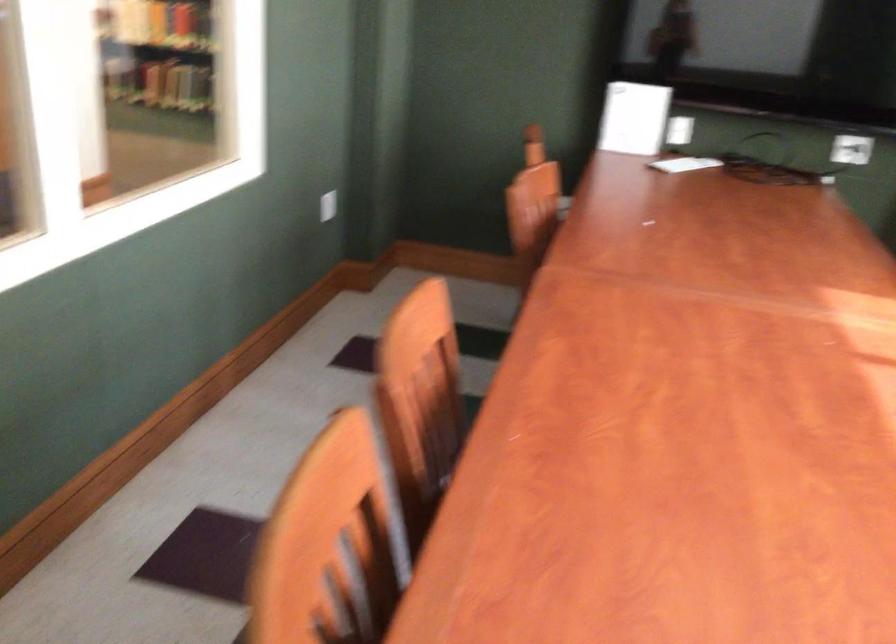
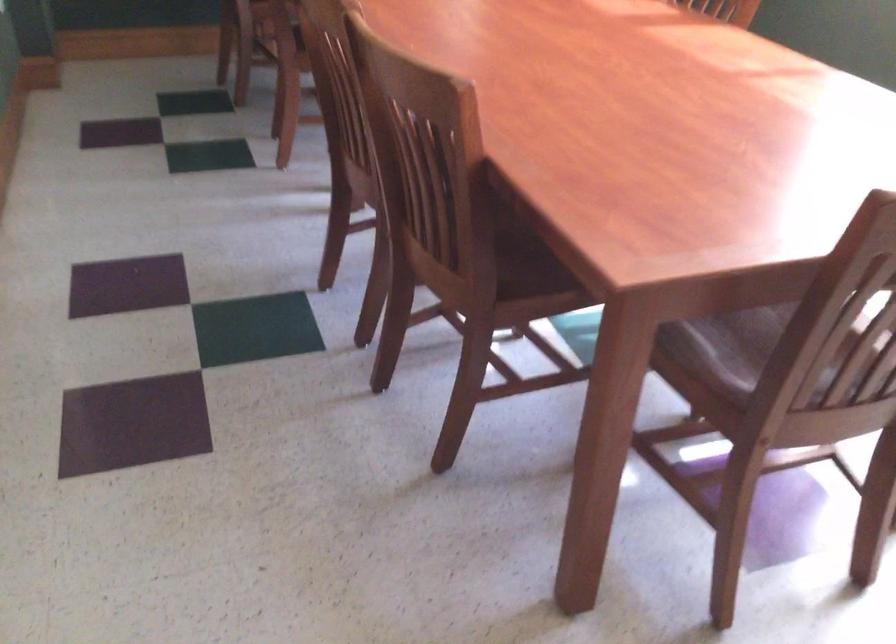
How did the camera likely rotate?

The camera rotated toward right-down.